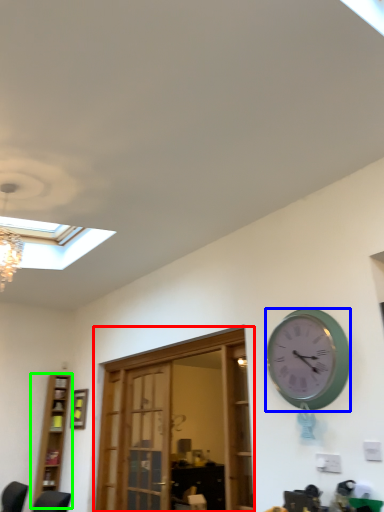
Question: Based on their relative distances, which object is farther from door (highlighted by a red box)? Choose from wall clock (highlighted by a blue box) and bookshelf (highlighted by a green box).

Choices:
 (A) wall clock
 (B) bookshelf

Answer: (B)